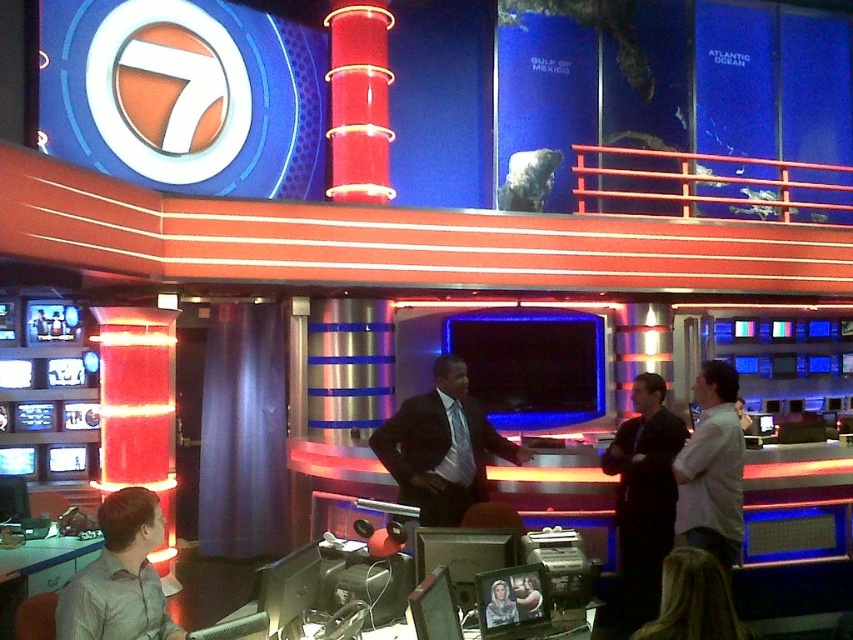
In the TV studio scene, there is a person in a matte black suit at center and other people around. If you were standing at the point marked by coordinates point (440, 445), which corresponds to the matte black suit at center, which direction would you face to see the two people standing to the right of the matte black suit at center?

You would face to the right to see the two people standing to the right of the matte black suit at center.